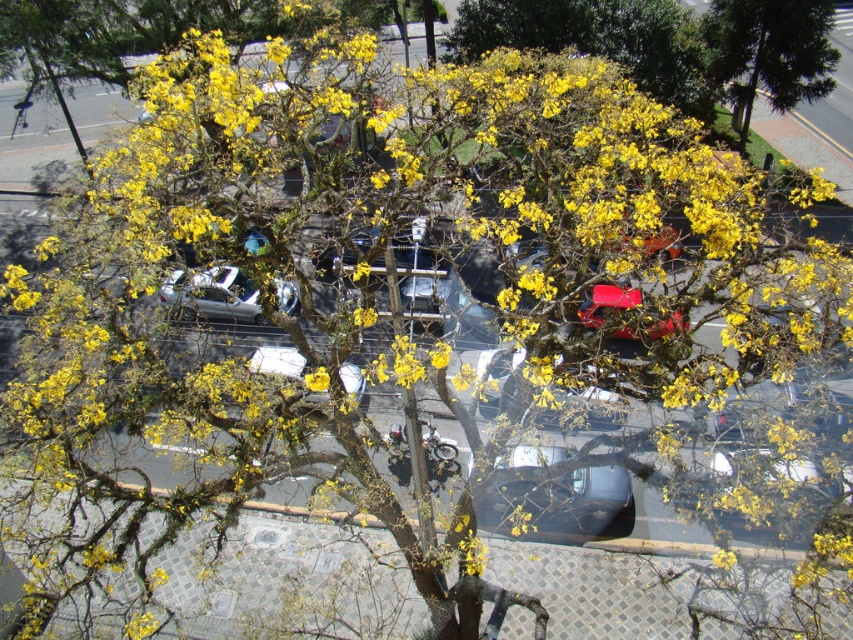
You are a delivery person trying to park a tall delivery van in this street. You see the metallic silver car at center and the shiny red car at center parked there. Which car should you avoid parking next to to ensure enough clearance for your van?

You should avoid parking next to the metallic silver car at center because it is much taller than the shiny red car at center, which may require more vertical space for clearance.

You are a pedestrian standing on the sidewalk and want to take a photo of the satin silver car at center without the green textured pine tree at upper right blocking the view. Which direction should you move to ensure the tree is out of frame?

Move to the left side of the satin silver car at center so that the green textured pine tree at upper right is no longer blocking the view.